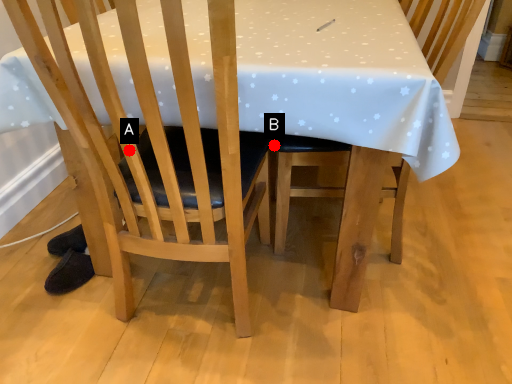
Question: Two points are circled on the image, labeled by A and B beside each circle. Which point is closer to the camera?

Choices:
 (A) A is closer
 (B) B is closer

Answer: (A)